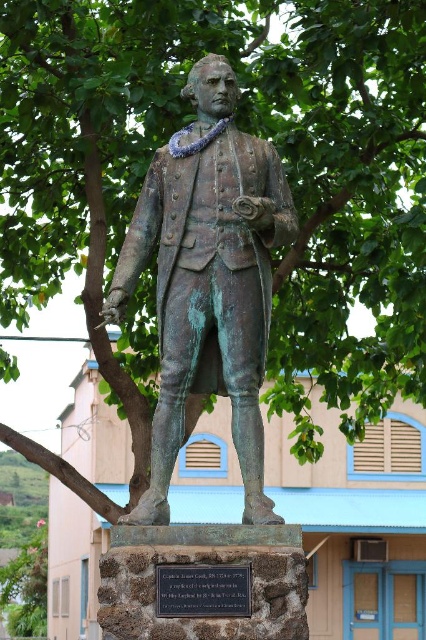
Who is lower down, green patina statue at center or black stone plaque at center?

black stone plaque at center

Between point (227, 280) and point (189, 586), which one is positioned in front?

Point (189, 586)

The image size is (426, 640). Identify the location of green patina statue at center. (207, 280).